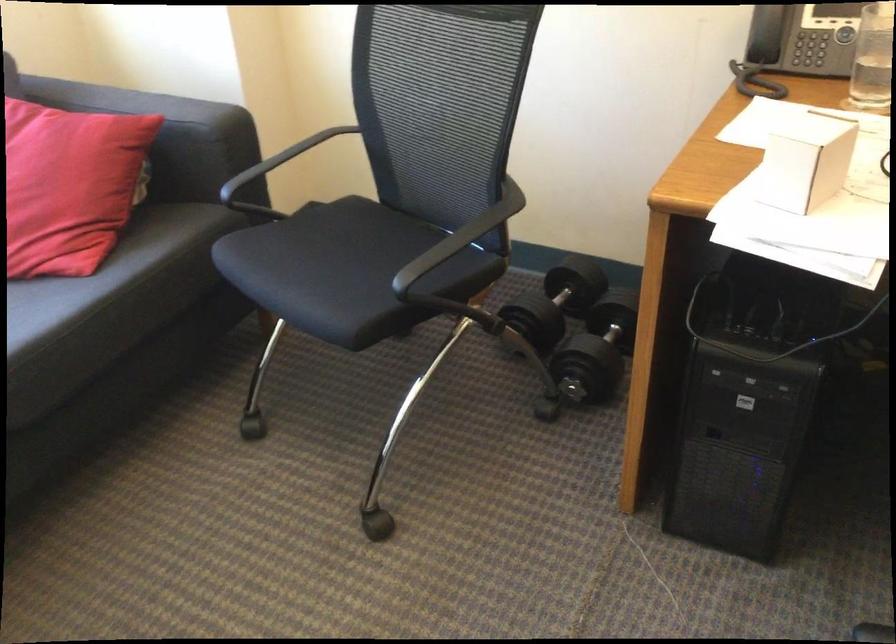
What do you see at coordinates (343, 270) in the screenshot? I see `a black chair sitting surface` at bounding box center [343, 270].